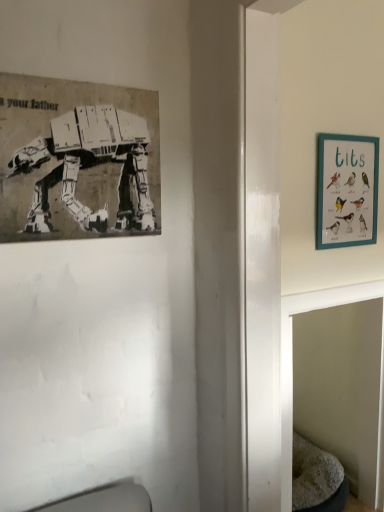
Question: Is gray fabric cat bed at lower right oriented away from teal wooden picture frame at upper right, arranged as the first picture frame when viewed from the back?

Choices:
 (A) no
 (B) yes

Answer: (A)

Question: Is gray fabric cat bed at lower right closer to the viewer compared to teal wooden picture frame at upper right, which is the 2th picture frame from left to right?

Choices:
 (A) yes
 (B) no

Answer: (A)

Question: Is gray fabric cat bed at lower right located outside teal wooden picture frame at upper right, which is the 2th picture frame from left to right?

Choices:
 (A) no
 (B) yes

Answer: (B)

Question: From the image's perspective, would you say gray fabric cat bed at lower right is shown under teal wooden picture frame at upper right, the first picture frame positioned from the right?

Choices:
 (A) no
 (B) yes

Answer: (B)

Question: Is gray fabric cat bed at lower right further to camera compared to teal wooden picture frame at upper right, the first picture frame positioned from the right?

Choices:
 (A) yes
 (B) no

Answer: (B)

Question: Does gray fabric cat bed at lower right have a lesser width compared to teal wooden picture frame at upper right, arranged as the first picture frame when viewed from the back?

Choices:
 (A) yes
 (B) no

Answer: (B)

Question: Is black paper poster at upper left, marked as the 1th picture frame in a front-to-back arrangement, taller than gray fabric cat bed at lower right?

Choices:
 (A) no
 (B) yes

Answer: (A)

Question: Can you confirm if black paper poster at upper left, marked as the second picture frame in a right-to-left arrangement, is bigger than gray fabric cat bed at lower right?

Choices:
 (A) yes
 (B) no

Answer: (B)

Question: Is black paper poster at upper left, acting as the 1th picture frame starting from the left, to the right of gray fabric cat bed at lower right from the viewer's perspective?

Choices:
 (A) no
 (B) yes

Answer: (A)

Question: Is black paper poster at upper left, acting as the 1th picture frame starting from the left, shorter than gray fabric cat bed at lower right?

Choices:
 (A) no
 (B) yes

Answer: (B)

Question: Is black paper poster at upper left, the second picture frame viewed from the back, placed right next to gray fabric cat bed at lower right?

Choices:
 (A) yes
 (B) no

Answer: (B)

Question: Considering the relative sizes of black paper poster at upper left, marked as the second picture frame in a right-to-left arrangement, and gray fabric cat bed at lower right in the image provided, is black paper poster at upper left, marked as the second picture frame in a right-to-left arrangement, thinner than gray fabric cat bed at lower right?

Choices:
 (A) yes
 (B) no

Answer: (A)

Question: Considering the relative sizes of teal wooden picture frame at upper right, acting as the 2th picture frame starting from the front, and black paper poster at upper left, acting as the 1th picture frame starting from the left, in the image provided, is teal wooden picture frame at upper right, acting as the 2th picture frame starting from the front, bigger than black paper poster at upper left, acting as the 1th picture frame starting from the left,?

Choices:
 (A) no
 (B) yes

Answer: (A)